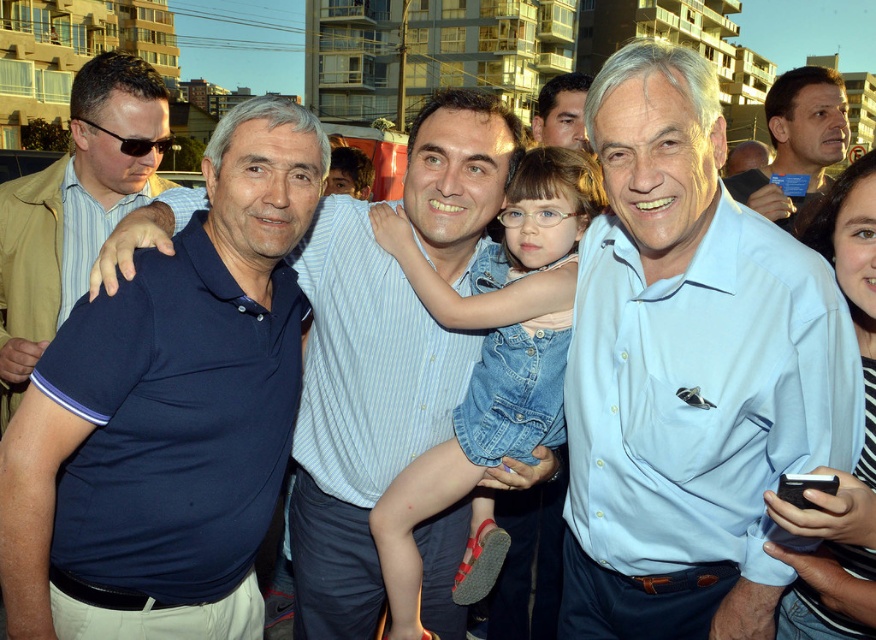
Between point (573, 566) and point (438, 536), which one is positioned in front?

Positioned in front is point (573, 566).

Which is more to the right, light blue shirt at center or dark blue polo shirt at center?

From the viewer's perspective, light blue shirt at center appears more on the right side.

The width and height of the screenshot is (876, 640). In order to click on light blue shirt at center in this screenshot , I will do `click(689, 372)`.

Is light blue shirt at center further to camera compared to denim dress at center?

No, it is not.

Find the location of a particular element. The width and height of the screenshot is (876, 640). light blue shirt at center is located at coordinates point(689,372).

Where is `light blue shirt at center`? The image size is (876, 640). light blue shirt at center is located at coordinates (689, 372).

Who is shorter, dark blue polo shirt at center or denim dress at center?

dark blue polo shirt at center

Which is above, dark blue polo shirt at center or denim dress at center?

denim dress at center is above.

Does point (447, 252) lie behind point (531, 230)?

Yes, point (447, 252) is farther from viewer.

The height and width of the screenshot is (640, 876). I want to click on dark blue polo shirt at center, so click(x=357, y=419).